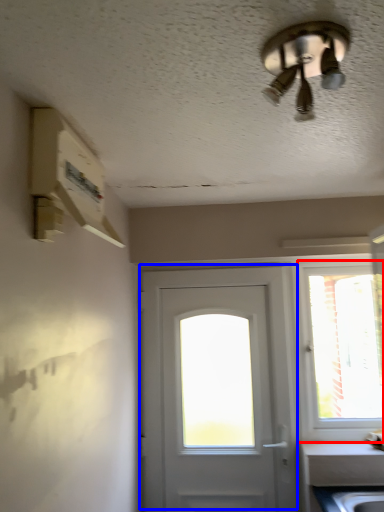
Question: Which object appears farthest to the camera in this image, window (highlighted by a red box) or door (highlighted by a blue box)?

Choices:
 (A) window
 (B) door

Answer: (A)